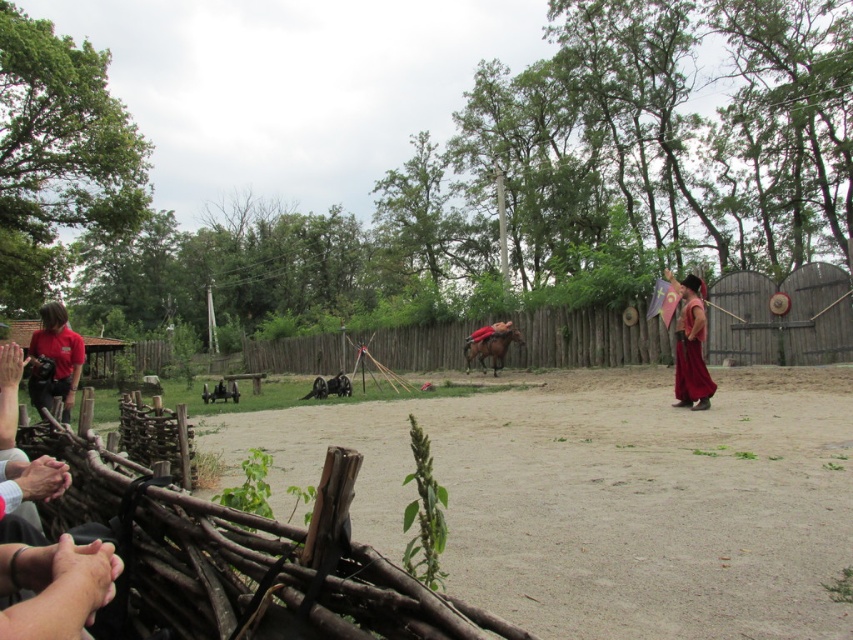
You are a spectator standing behind the rustic wooden fence in the foreground. You see the velvet maroon robe at right and the brown glossy horse at center. Which object is located to the right of the other?

The velvet maroon robe at right is positioned on the right side of brown glossy horse at center, so the velvet maroon robe at right is to the right of the brown glossy horse at center.

Looking at this image, you are a spectator at the event and want to take a photo of the matte red shirt at left and the brown sandy ground at center. Which object is positioned to the right of the other?

→ The brown sandy ground at center is to the right of matte red shirt at left.

You are standing at the point marked as point [607,497] in the image. What is the color of the ground beneath your feet?

The brown sandy ground at center is located at point [607,497], so the ground beneath your feet is brown sandy.